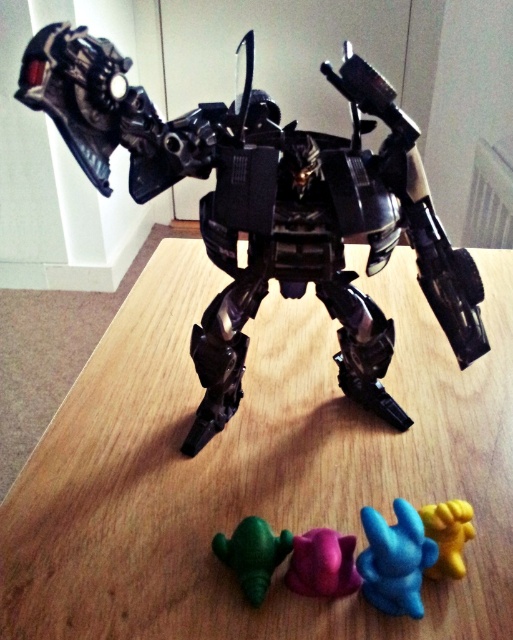
In the scene shown: Who is positioned more to the right, wooden table at center or metallic black robot at center?

wooden table at center

Can you confirm if wooden table at center is positioned above metallic black robot at center?

No, wooden table at center is not above metallic black robot at center.

Which is in front, point (325, 316) or point (455, 268)?

Point (455, 268) is in front.

At what (x,y) coordinates should I click in order to perform the action: click on wooden table at center. Please return your answer as a coordinate pair (x, y). The height and width of the screenshot is (640, 513). Looking at the image, I should click on (255, 468).

In the scene shown: Can you confirm if green matte turtle at lower left is shorter than yellow rubber toy at lower right?

Yes.

Locate an element on the screen. This screenshot has width=513, height=640. green matte turtle at lower left is located at coordinates (252, 554).

Who is higher up, black plastic gun at center or blue rubber toy at lower center?

Positioned higher is black plastic gun at center.

Who is positioned more to the left, black plastic gun at center or blue rubber toy at lower center?

blue rubber toy at lower center is more to the left.

The image size is (513, 640). I want to click on black plastic gun at center, so click(418, 211).

Locate an element on the screen. black plastic gun at center is located at coordinates (418, 211).